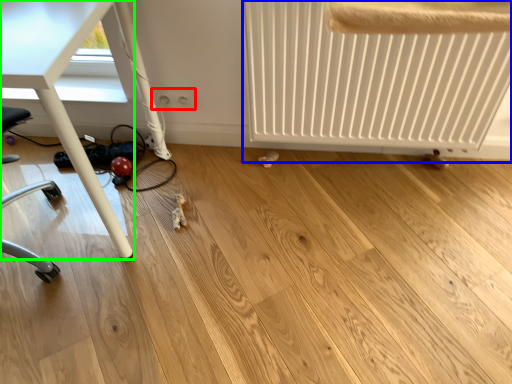
Question: Which object is positioned farthest from electric outlet (highlighted by a red box)? Select from radiator (highlighted by a blue box) and table (highlighted by a green box).

Choices:
 (A) radiator
 (B) table

Answer: (A)